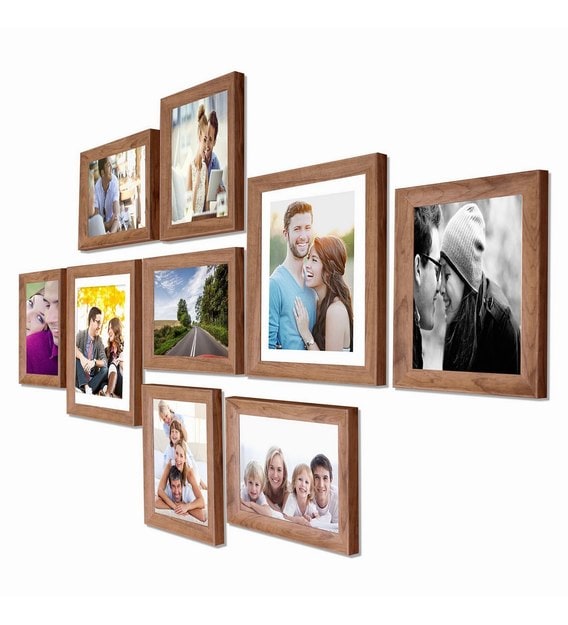
The width and height of the screenshot is (568, 625). I want to click on photo in frame, so click(470, 262), click(319, 250), click(185, 158), click(105, 168), click(37, 349), click(80, 345), click(189, 325), click(166, 522), click(329, 471).